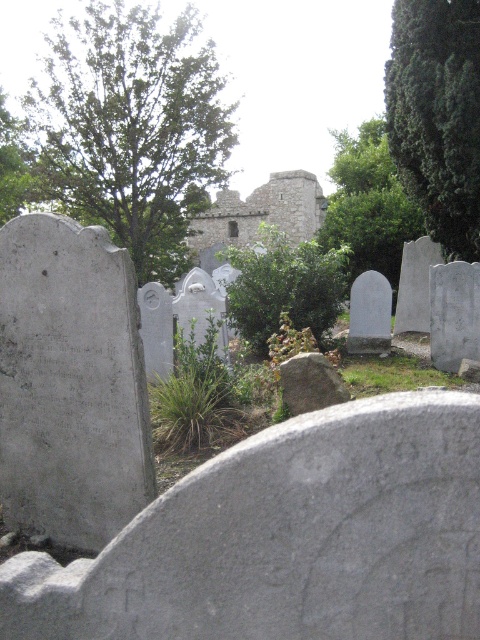
Question: Can you confirm if green leafy bush at center is positioned to the right of gray rough stone at center?

Choices:
 (A) yes
 (B) no

Answer: (B)

Question: Which object is positioned farthest from the gray rough stone at center?

Choices:
 (A) green textured tree at upper right
 (B) green leafy bush at center
 (C) green leafy tree at center

Answer: (C)

Question: Is green textured tree at upper right closer to camera compared to green leafy bush at center?

Choices:
 (A) yes
 (B) no

Answer: (B)

Question: Which object is farther from the camera taking this photo?

Choices:
 (A) gray rough stone at center
 (B) green leafy tree at center

Answer: (B)

Question: Which point is closer to the camera?

Choices:
 (A) green leafy tree at center
 (B) gray rough stone at center
 (C) green leafy bush at center

Answer: (B)

Question: Does green leafy tree at upper left have a smaller size compared to gray rough stone at center?

Choices:
 (A) yes
 (B) no

Answer: (B)